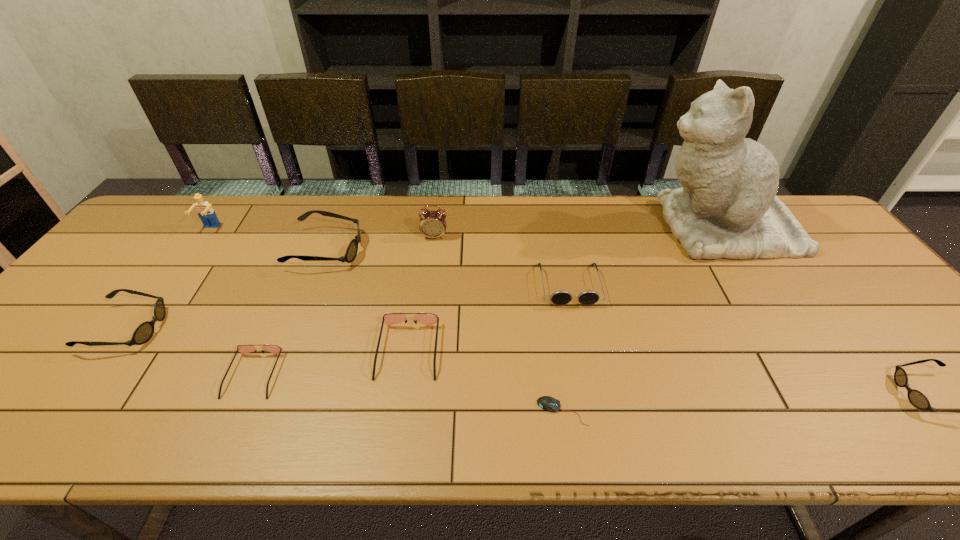
Identify the location of object at the right edge. The height and width of the screenshot is (540, 960). (727, 207).

Where is `object present at the far right corner`? The width and height of the screenshot is (960, 540). object present at the far right corner is located at coordinates (727, 207).

Where is `vacant position at the far edge of the desktop`? The height and width of the screenshot is (540, 960). vacant position at the far edge of the desktop is located at coordinates (485, 198).

In the image, there is a desktop. At what (x,y) coordinates should I click in order to perform the action: click on free space at the near edge. Please return your answer as a coordinate pair (x, y). The image size is (960, 540). Looking at the image, I should click on (45, 447).

In the image, there is a desktop. Identify the location of free space at the left edge. The image size is (960, 540). (6, 390).

The image size is (960, 540). Find the location of `vacant space at the right edge of the desktop`. vacant space at the right edge of the desktop is located at coordinates (856, 307).

Find the location of a particular element. The width and height of the screenshot is (960, 540). vacant space at the far left corner of the desktop is located at coordinates (142, 234).

At what (x,y) coordinates should I click in order to perform the action: click on free spot between the smaller pink sunglasses and the blue Lego. Please return your answer as a coordinate pair (x, y). Looking at the image, I should click on (232, 302).

Image resolution: width=960 pixels, height=540 pixels. I want to click on free point between the tallest object and the fifth sunglasses from left to right, so click(x=645, y=256).

Find the location of a particular element. The image size is (960, 540). free space between the second sunglasses from right to left and the tallest sunglasses is located at coordinates (447, 267).